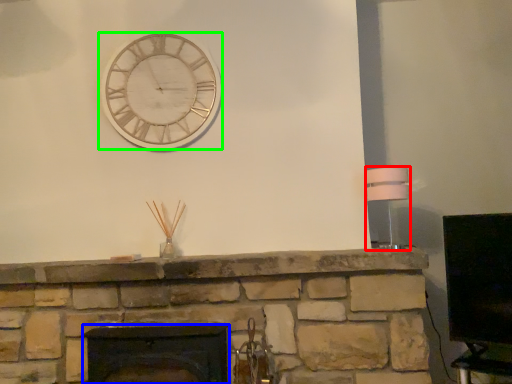
Question: Based on their relative distances, which object is nearer to lamp (highlighted by a red box)? Choose from fireplace (highlighted by a blue box) and wall clock (highlighted by a green box).

Choices:
 (A) fireplace
 (B) wall clock

Answer: (B)